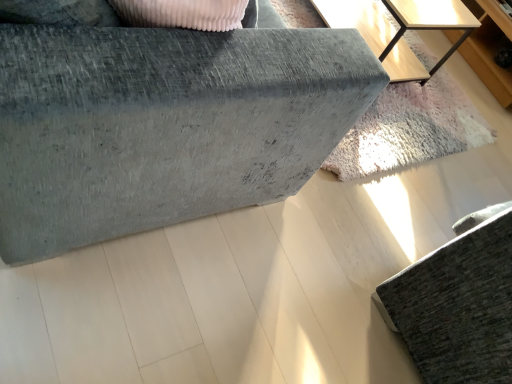
Question: Is textured gray sofa at lower right, acting as the 2th furniture starting from the left, at the right side of light wood table at upper right?

Choices:
 (A) no
 (B) yes

Answer: (B)

Question: Is textured gray sofa at lower right, acting as the 2th furniture starting from the left, shorter than light wood table at upper right?

Choices:
 (A) no
 (B) yes

Answer: (A)

Question: Is textured gray sofa at lower right, acting as the 2th furniture starting from the left, not near light wood table at upper right?

Choices:
 (A) yes
 (B) no

Answer: (A)

Question: Can you confirm if textured gray sofa at lower right, the 1th furniture positioned from the right, is smaller than light wood table at upper right?

Choices:
 (A) no
 (B) yes

Answer: (A)

Question: From the image's perspective, does textured gray sofa at lower right, acting as the 2th furniture starting from the left, appear lower than light wood table at upper right?

Choices:
 (A) no
 (B) yes

Answer: (B)

Question: Is textured gray sofa at lower right, acting as the 2th furniture starting from the left, further to camera compared to light wood table at upper right?

Choices:
 (A) no
 (B) yes

Answer: (A)

Question: Considering the relative sizes of textured gray sofa at lower right, the 1th furniture positioned from the right, and light wood dresser at upper right in the image provided, is textured gray sofa at lower right, the 1th furniture positioned from the right, bigger than light wood dresser at upper right?

Choices:
 (A) no
 (B) yes

Answer: (B)

Question: Could you tell me if textured gray sofa at lower right, the 1th furniture positioned from the right, is facing light wood dresser at upper right?

Choices:
 (A) yes
 (B) no

Answer: (B)

Question: From the image's perspective, is textured gray sofa at lower right, the 1th furniture positioned from the right, under light wood dresser at upper right?

Choices:
 (A) no
 (B) yes

Answer: (B)

Question: Does textured gray sofa at lower right, acting as the 2th furniture starting from the left, appear on the left side of light wood dresser at upper right?

Choices:
 (A) yes
 (B) no

Answer: (A)

Question: Is textured gray sofa at lower right, acting as the 2th furniture starting from the left, next to light wood dresser at upper right?

Choices:
 (A) yes
 (B) no

Answer: (B)

Question: Can you confirm if textured gray sofa at lower right, acting as the 2th furniture starting from the left, is shorter than light wood dresser at upper right?

Choices:
 (A) no
 (B) yes

Answer: (A)

Question: Is light wood table at upper right in contact with textured gray sofa at lower right, the 1th furniture positioned from the right?

Choices:
 (A) no
 (B) yes

Answer: (A)